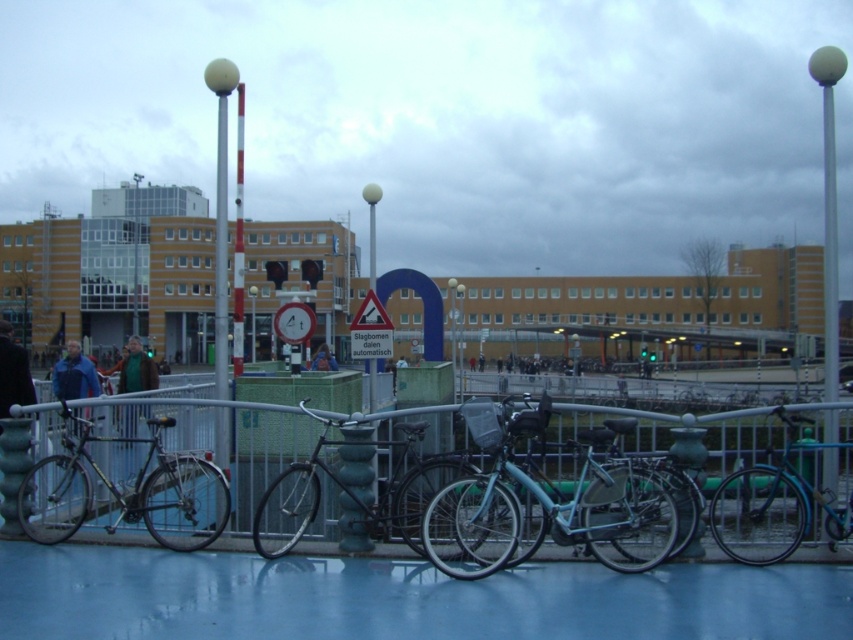
You are a delivery person trying to see the signboard behind the metallic silver fence at center and the shiny metallic bicycle at left. Can you see the signboard clearly from your current position?

The metallic silver fence at center is taller than the shiny metallic bicycle at left. Since the fence is taller, it might block your view of the signboard behind them.